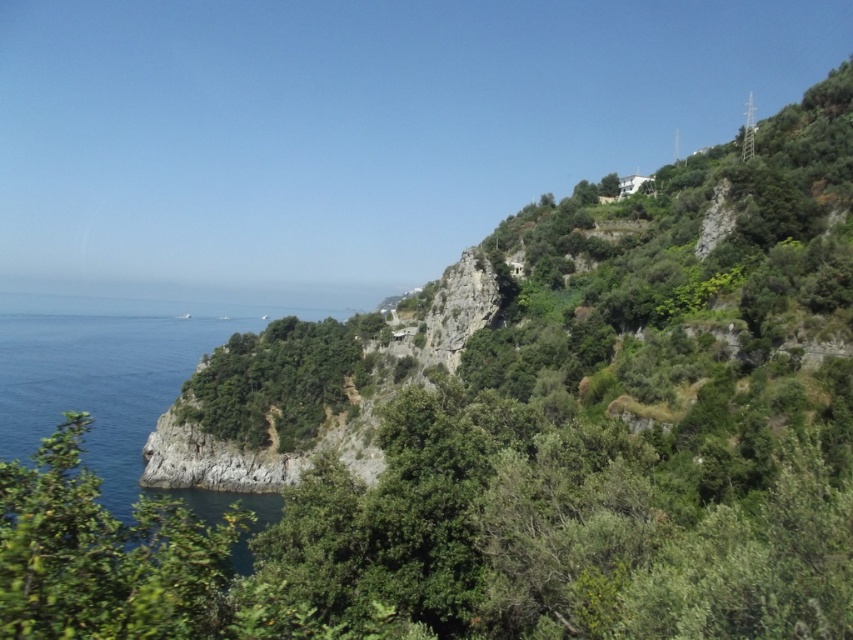
You are standing on a cliff overlooking the coast and want to throw a pebble into the blue water at lower left. Considering the distance between you and the water is 97.25 feet, do you think you can reach it with a single throw?

The distance between you and the blue water at lower left is 97.25 feet. A typical human can throw a pebble about 50 to 100 feet, so it is possible to reach the blue water at lower left with a strong throw.

You are standing in the coastal landscape and want to take a photo of the blue water at lower left and the green leafy tree at lower left. Which object is positioned more to the left side of the scene?

The blue water at lower left is positioned to the left of the green leafy tree at lower left, so the blue water at lower left is more to the left side of the scene.

You are a photographer planning to capture the blue water at lower left and the green leafy tree at lower left in a single frame. Based on the scene, which object should you focus on first to ensure both are in the frame without moving the camera?

Since the blue water at lower left is larger in size compared to the green leafy tree at lower left, you should focus on the blue water at lower left first to ensure both fit within the frame.